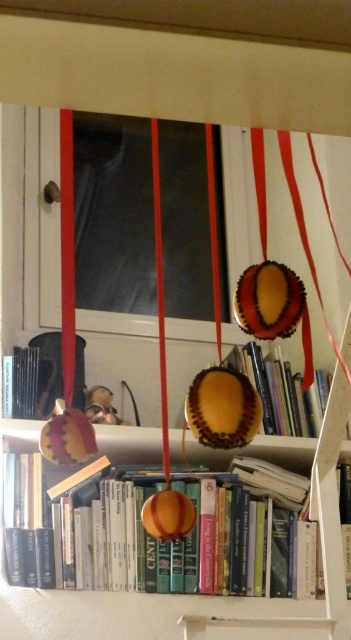
Question: Which object appears farthest from the camera in this image?

Choices:
 (A) orange matte/orange matte/orange matte/orange matte/orange matte/orange matte/orange matte/orange matte/orange matte/orange matte/orange matte/orange matte/orange matte/orange matte/orange matte/orange matte/orange matte/orange matte/orange matte/orange matte/orange matte/orange matte/orange matte/orange matte/orange matte/orange matte/orange matte/orange matte/orange matte/orange matte/orange matte/orange matte/orange matte/orange matte/orange matte/orange matte/orange matte/orange matte/orange matte/orange matte/orange matte/orange matte/orange
 (B) matte orange ornament at center

Answer: (B)

Question: Can you confirm if orange matte/orange matte/orange matte/orange matte/orange matte/orange matte/orange matte/orange matte/orange matte/orange matte/orange matte/orange matte/orange matte/orange matte/orange matte/orange matte/orange matte/orange matte/orange matte/orange matte/orange matte/orange matte/orange matte/orange matte/orange matte/orange matte/orange matte/orange matte/orange matte/orange matte/orange matte/orange matte/orange matte/orange matte/orange matte/orange matte/orange matte/orange matte/orange matte/orange matte/orange matte/orange matte/orange is smaller than matte orange ornament at center?

Choices:
 (A) no
 (B) yes

Answer: (A)

Question: Is orange matte/orange matte/orange matte/orange matte/orange matte/orange matte/orange matte/orange matte/orange matte/orange matte/orange matte/orange matte/orange matte/orange matte/orange matte/orange matte/orange matte/orange matte/orange matte/orange matte/orange matte/orange matte/orange matte/orange matte/orange matte/orange matte/orange matte/orange matte/orange matte/orange matte/orange matte/orange matte/orange matte/orange matte/orange matte/orange matte/orange matte/orange matte/orange matte/orange matte/orange matte/orange matte/orange positioned at the back of matte orange ornament at center?

Choices:
 (A) yes
 (B) no

Answer: (B)

Question: Can you confirm if orange matte/orange matte/orange matte/orange matte/orange matte/orange matte/orange matte/orange matte/orange matte/orange matte/orange matte/orange matte/orange matte/orange matte/orange matte/orange matte/orange matte/orange matte/orange matte/orange matte/orange matte/orange matte/orange matte/orange matte/orange matte/orange matte/orange matte/orange matte/orange matte/orange matte/orange matte/orange matte/orange matte/orange matte/orange matte/orange matte/orange matte/orange matte/orange matte/orange matte/orange matte/orange matte/orange is wider than matte orange ornament at center?

Choices:
 (A) no
 (B) yes

Answer: (B)

Question: Which point appears closest to the camera in this image?

Choices:
 (A) (314, 406)
 (B) (102, 582)

Answer: (B)